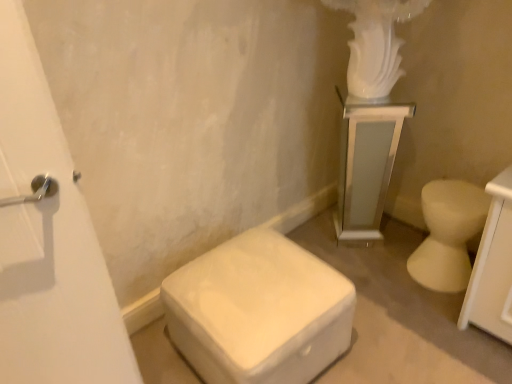
Image resolution: width=512 pixels, height=384 pixels. Find the location of `empty space that is ontop of white matte ottoman at lower center, which ranks as the first toilet in left-to-right order (from a real-world perspective)`. empty space that is ontop of white matte ottoman at lower center, which ranks as the first toilet in left-to-right order (from a real-world perspective) is located at coordinates (242, 276).